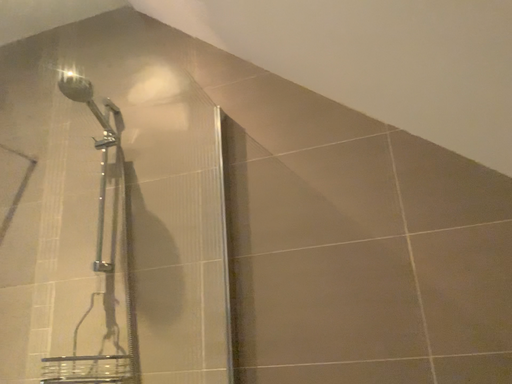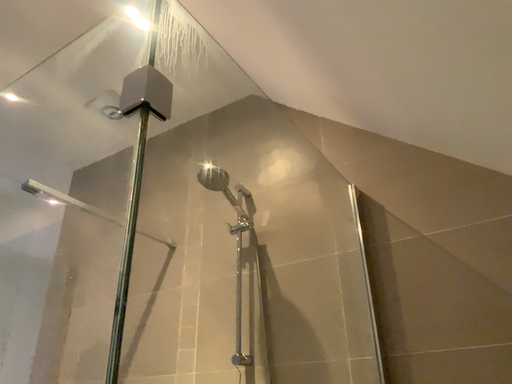
Question: How did the camera likely rotate when shooting the video?

Choices:
 (A) rotated right
 (B) rotated left

Answer: (B)